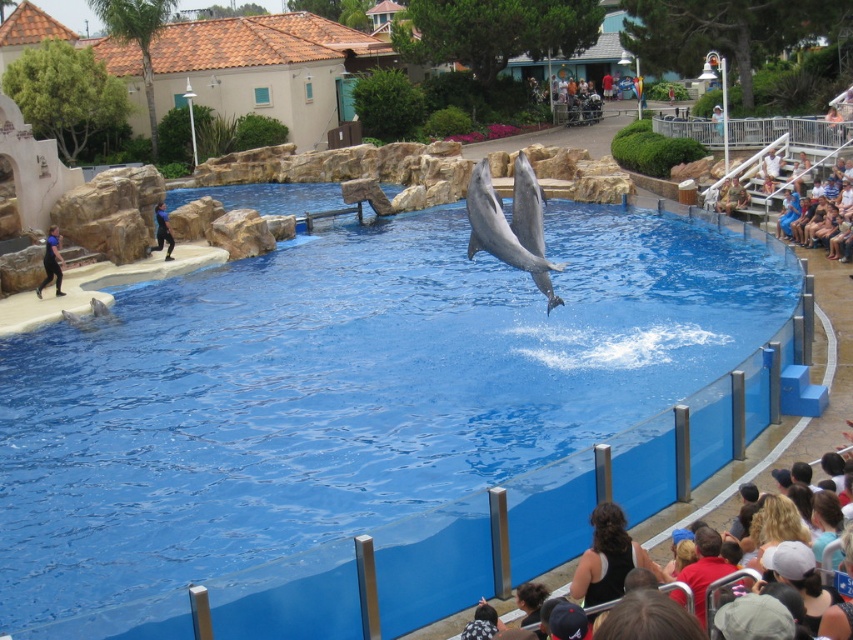
Who is shorter, black fabric at lower center or brown hair at lower right?

With less height is black fabric at lower center.

At what (x,y) coordinates should I click in order to perform the action: click on black fabric at lower center. Please return your answer as a coordinate pair (x, y). The width and height of the screenshot is (853, 640). Looking at the image, I should click on (608, 557).

Where is `black fabric at lower center`? black fabric at lower center is located at coordinates (608, 557).

Is black fabric at lower center thinner than blue fabric shirt at left?

No.

Is black fabric at lower center above blue fabric shirt at left?

No.

Is point (611, 513) less distant than point (155, 250)?

Yes, it is in front of point (155, 250).

The image size is (853, 640). In order to click on black fabric at lower center in this screenshot , I will do `click(608, 557)`.

Who is positioned more to the right, gray smooth dolphin at center or black rubber wetsuit at lower left?

Positioned to the right is gray smooth dolphin at center.

Does gray smooth dolphin at center appear on the right side of black rubber wetsuit at lower left?

Indeed, gray smooth dolphin at center is positioned on the right side of black rubber wetsuit at lower left.

Does point (488, 240) come behind point (55, 268)?

No, (488, 240) is in front of (55, 268).

At what (x,y) coordinates should I click in order to perform the action: click on gray smooth dolphin at center. Please return your answer as a coordinate pair (x, y). Looking at the image, I should click on (511, 225).